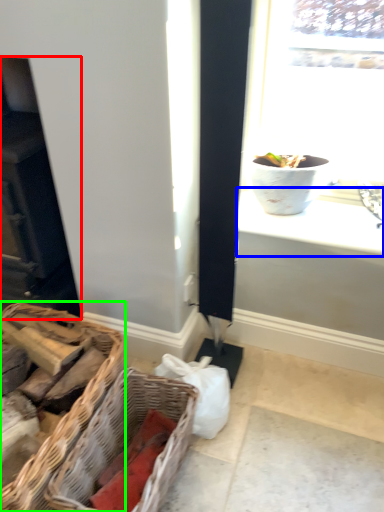
Question: Which object is positioned closest to fireplace (highlighted by a red box)? Select from window sill (highlighted by a blue box) and picnic basket (highlighted by a green box).

Choices:
 (A) window sill
 (B) picnic basket

Answer: (B)